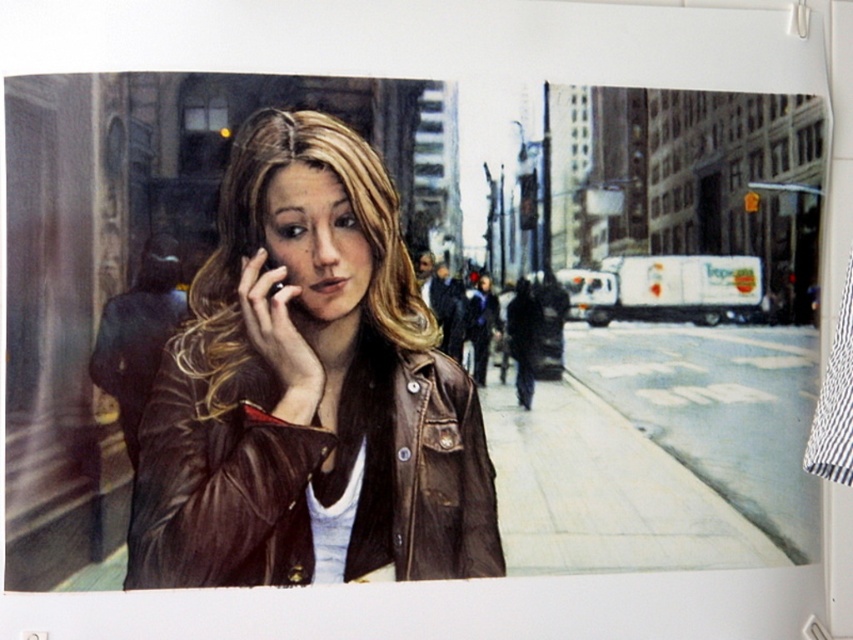
Question: Which point is farther from the camera taking this photo?

Choices:
 (A) (212, 454)
 (B) (279, 288)

Answer: (B)

Question: Is brown leather jacket at center wider than matte black phone at center?

Choices:
 (A) no
 (B) yes

Answer: (B)

Question: Among these points, which one is farthest from the camera?

Choices:
 (A) (318, 525)
 (B) (265, 260)

Answer: (B)

Question: Is brown leather jacket at center to the right of matte black phone at center from the viewer's perspective?

Choices:
 (A) yes
 (B) no

Answer: (A)

Question: Does brown leather jacket at center appear on the left side of matte black phone at center?

Choices:
 (A) yes
 (B) no

Answer: (B)

Question: Which of the following is the closest to the observer?

Choices:
 (A) matte black phone at center
 (B) brown leather jacket at center

Answer: (B)